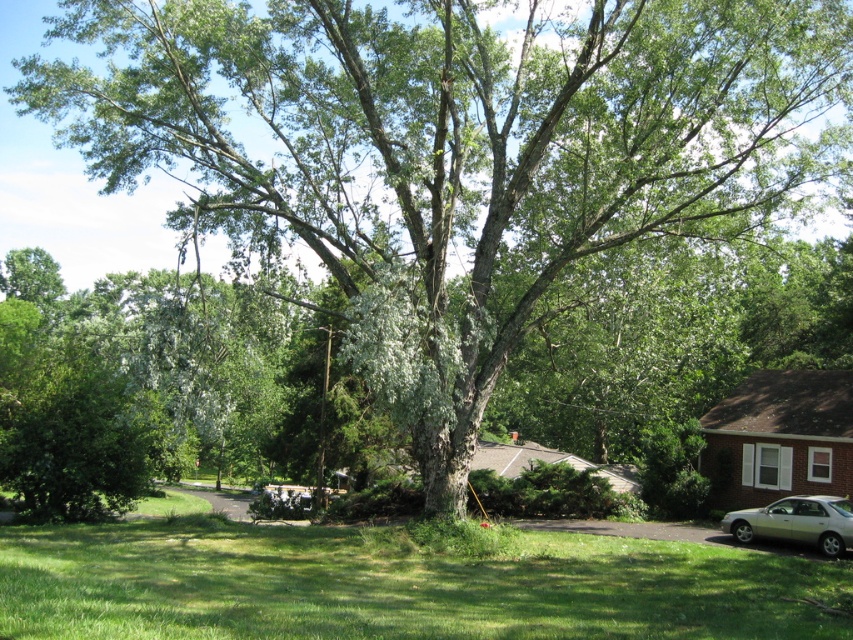
You are standing in the suburban scene and want to walk from the green grass at lower center to the silver metallic car at lower right. Which direction should you move to get closer to the car?

Since the green grass at lower center is closer to the viewer than the silver metallic car at lower right, you should move forward away from the viewer to reach the car.

You are a gardener planning to mow the lawn. You see the green grass at lower center and the silver metallic car at lower right. Which area should you avoid mowing to prevent hitting the car?

You should avoid mowing the area near the green grass at lower center since it is located to the left of the silver metallic car at lower right, meaning the car is positioned to the right of the grass. Mowing too close to the car could result in accidental contact.